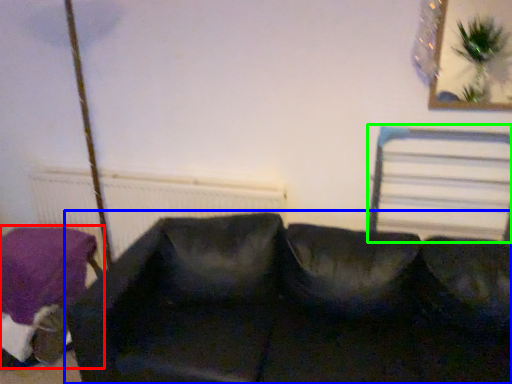
Question: Based on their relative distances, which object is nearer to furniture (highlighted by a red box)? Choose from studio couch (highlighted by a blue box) and bed frame (highlighted by a green box).

Choices:
 (A) studio couch
 (B) bed frame

Answer: (A)